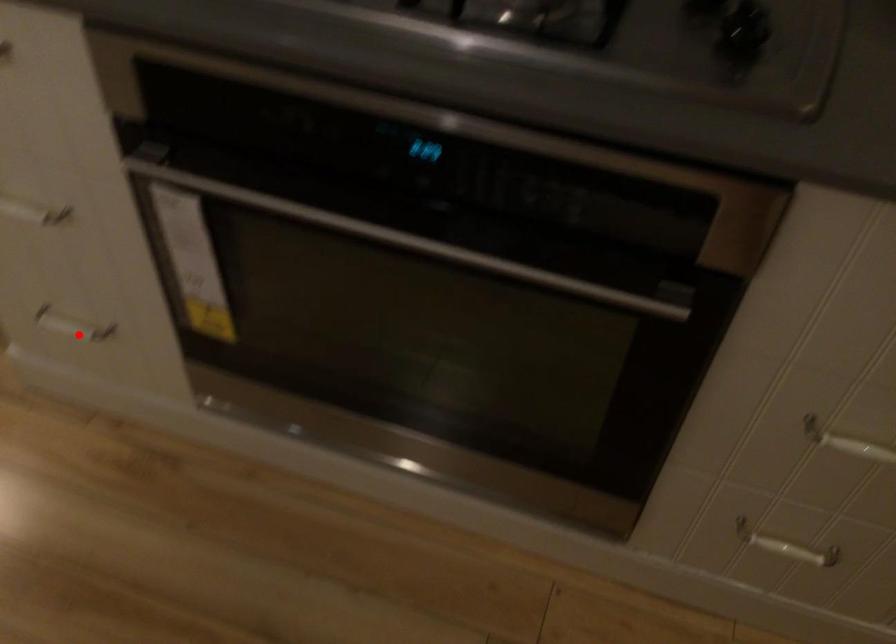
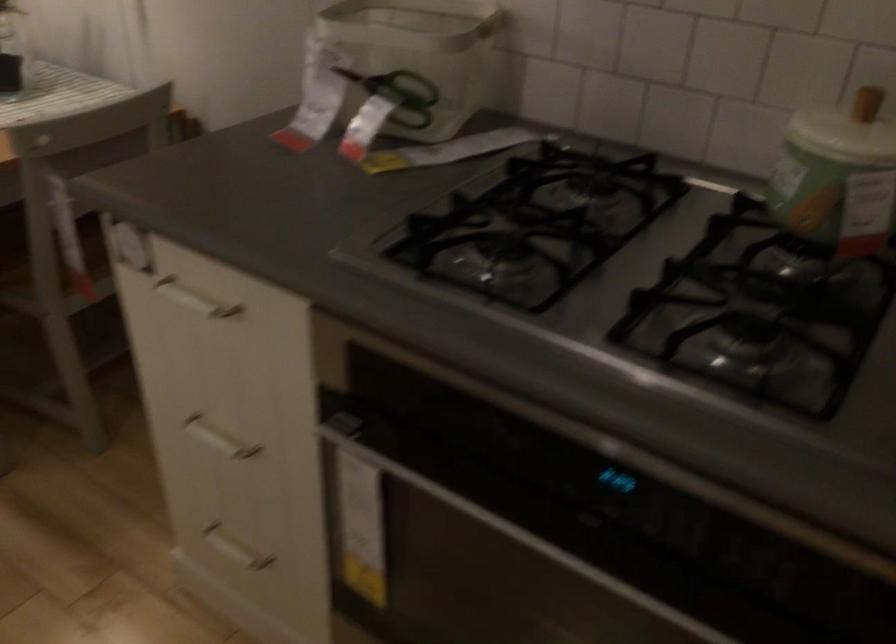
Locate, in the second image, the point that corresponds to the highlighted location in the first image.

(234, 549)